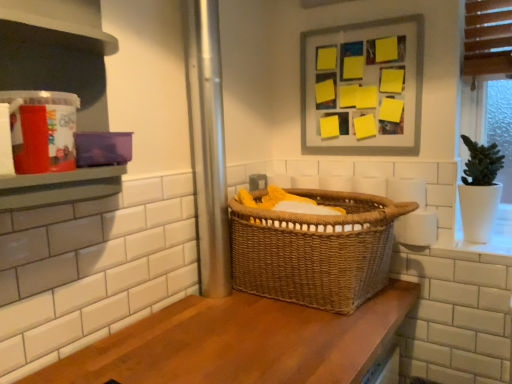
Question: From a real-world perspective, is woven brown basket at center over white matte toilet paper at right, which is the first toilet paper in top-to-bottom order?

Choices:
 (A) no
 (B) yes

Answer: (A)

Question: Would you say white matte toilet paper at right, positioned as the 2th toilet paper in bottom-to-top order, is part of woven brown basket at center's contents?

Choices:
 (A) no
 (B) yes

Answer: (A)

Question: Is there a large distance between woven brown basket at center and white matte toilet paper at right, which is the first toilet paper in top-to-bottom order?

Choices:
 (A) yes
 (B) no

Answer: (B)

Question: From the image's perspective, is woven brown basket at center over white matte toilet paper at right, positioned as the 2th toilet paper in bottom-to-top order?

Choices:
 (A) yes
 (B) no

Answer: (B)

Question: Is woven brown basket at center facing away from white matte toilet paper at right, which is the first toilet paper in top-to-bottom order?

Choices:
 (A) yes
 (B) no

Answer: (A)

Question: Does woven brown basket at center have a larger size compared to white matte toilet paper at right, positioned as the 2th toilet paper in bottom-to-top order?

Choices:
 (A) no
 (B) yes

Answer: (B)

Question: Can you confirm if white matte toilet paper at right, which is the first toilet paper in top-to-bottom order, is positioned to the left of wooden counter at center?

Choices:
 (A) yes
 (B) no

Answer: (B)

Question: Is white matte toilet paper at right, which is the first toilet paper in top-to-bottom order, far away from wooden counter at center?

Choices:
 (A) yes
 (B) no

Answer: (B)

Question: From the image's perspective, does white matte toilet paper at right, which is the first toilet paper in top-to-bottom order, appear lower than wooden counter at center?

Choices:
 (A) no
 (B) yes

Answer: (A)

Question: Can you confirm if white matte toilet paper at right, positioned as the 2th toilet paper in bottom-to-top order, is wider than wooden counter at center?

Choices:
 (A) yes
 (B) no

Answer: (B)

Question: From the image's perspective, would you say white matte toilet paper at right, which is the first toilet paper in top-to-bottom order, is positioned over wooden counter at center?

Choices:
 (A) no
 (B) yes

Answer: (B)

Question: Is white matte toilet paper at right, which is the first toilet paper in top-to-bottom order, surrounding wooden counter at center?

Choices:
 (A) no
 (B) yes

Answer: (A)

Question: Can you confirm if matte plastic container at left is taller than yellow paper at upper center?

Choices:
 (A) yes
 (B) no

Answer: (A)